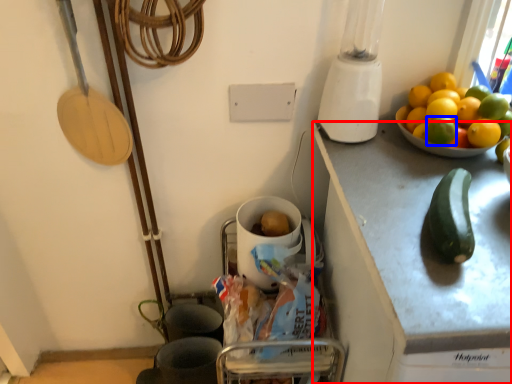
Question: Which object appears closest to the camera in this image, cabinetry (highlighted by a red box) or lemon (highlighted by a blue box)?

Choices:
 (A) cabinetry
 (B) lemon

Answer: (A)